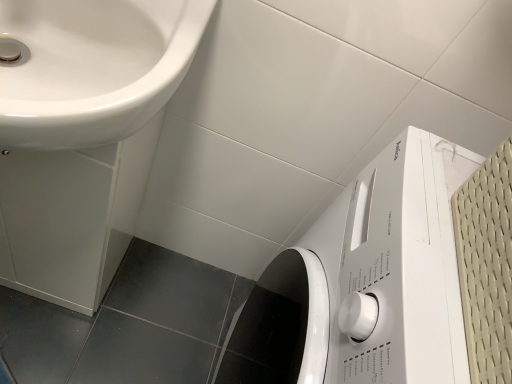
What do you see at coordinates (82, 140) in the screenshot? Image resolution: width=512 pixels, height=384 pixels. I see `white glossy sink at upper left` at bounding box center [82, 140].

In order to click on white glossy sink at upper left in this screenshot , I will do `click(82, 140)`.

Identify the location of white glossy washing machine at lower right. (364, 283).

Image resolution: width=512 pixels, height=384 pixels. Describe the element at coordinates (364, 283) in the screenshot. I see `white glossy washing machine at lower right` at that location.

The height and width of the screenshot is (384, 512). Identify the location of white glossy sink at upper left. (82, 140).

Can you confirm if white glossy washing machine at lower right is positioned to the left of white glossy sink at upper left?

Incorrect, white glossy washing machine at lower right is not on the left side of white glossy sink at upper left.

Is white glossy washing machine at lower right closer to camera compared to white glossy sink at upper left?

Yes, it is.

Considering the points (417, 363) and (46, 89), which point is behind, point (417, 363) or point (46, 89)?

The point (46, 89) is farther from the camera.

From the image's perspective, is white glossy washing machine at lower right below white glossy sink at upper left?

Indeed, from the image's perspective, white glossy washing machine at lower right is shown beneath white glossy sink at upper left.

From a real-world perspective, who is located lower, white glossy washing machine at lower right or white glossy sink at upper left?

white glossy sink at upper left, from a real-world perspective.

Looking at this image, looking at their sizes, would you say white glossy washing machine at lower right is wider or thinner than white glossy sink at upper left?

Considering their sizes, white glossy washing machine at lower right looks broader than white glossy sink at upper left.

Is white glossy washing machine at lower right taller or shorter than white glossy sink at upper left?

white glossy washing machine at lower right is taller than white glossy sink at upper left.

Who is smaller, white glossy washing machine at lower right or white glossy sink at upper left?

white glossy sink at upper left.

Could white glossy sink at upper left be considered to be inside white glossy washing machine at lower right?

Actually, white glossy sink at upper left is outside white glossy washing machine at lower right.

Would you consider white glossy washing machine at lower right to be distant from white glossy sink at upper left?

No, white glossy washing machine at lower right is not far from white glossy sink at upper left.

Is white glossy washing machine at lower right positioned with its back to white glossy sink at upper left?

No, white glossy washing machine at lower right's orientation is not away from white glossy sink at upper left.

How many degrees apart are the facing directions of white glossy washing machine at lower right and white glossy sink at upper left?

white glossy washing machine at lower right and white glossy sink at upper left are facing 88.1 degrees away from each other.

How far apart are white glossy washing machine at lower right and white glossy sink at upper left?

white glossy washing machine at lower right is 15.84 inches from white glossy sink at upper left.

Locate an element on the screen. This screenshot has height=384, width=512. sink that appears below the white glossy washing machine at lower right (from a real-world perspective) is located at coordinates (82, 140).

Can you confirm if white glossy sink at upper left is positioned to the left of white glossy washing machine at lower right?

Yes.

Is white glossy sink at upper left positioned behind white glossy washing machine at lower right?

Yes.

Is point (16, 122) farther from viewer compared to point (379, 330)?

No, (16, 122) is in front of (379, 330).

From the image's perspective, is white glossy sink at upper left on top of white glossy washing machine at lower right?

Yes, from the image's perspective, white glossy sink at upper left is above white glossy washing machine at lower right.

From a real-world perspective, which is physically above, white glossy sink at upper left or white glossy washing machine at lower right?

white glossy washing machine at lower right, from a real-world perspective.

Is white glossy sink at upper left wider than white glossy washing machine at lower right?

No, white glossy sink at upper left is not wider than white glossy washing machine at lower right.

Is white glossy sink at upper left taller than white glossy washing machine at lower right?

No, white glossy sink at upper left is not taller than white glossy washing machine at lower right.

Does white glossy sink at upper left have a larger size compared to white glossy washing machine at lower right?

Actually, white glossy sink at upper left might be smaller than white glossy washing machine at lower right.

Is white glossy washing machine at lower right completely or partially inside white glossy sink at upper left?

No, white glossy washing machine at lower right is not a part of white glossy sink at upper left.

Is white glossy sink at upper left not close to white glossy washing machine at lower right?

Actually, white glossy sink at upper left and white glossy washing machine at lower right are a little close together.

Is white glossy sink at upper left aimed at white glossy washing machine at lower right?

No, white glossy sink at upper left is not turned towards white glossy washing machine at lower right.

What's the angular difference between white glossy sink at upper left and white glossy washing machine at lower right's facing directions?

88.1 degrees.

Where is `sink behind the white glossy washing machine at lower right`? The image size is (512, 384). sink behind the white glossy washing machine at lower right is located at coordinates (82, 140).

Find the location of a particular element. This screenshot has height=384, width=512. sink below the white glossy washing machine at lower right (from a real-world perspective) is located at coordinates (82, 140).

The width and height of the screenshot is (512, 384). I want to click on washing machine in front of the white glossy sink at upper left, so click(364, 283).